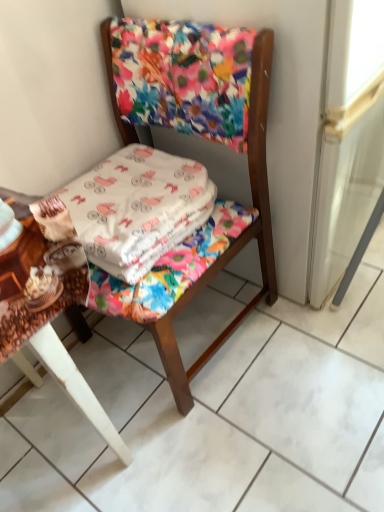
You are a GUI agent. You are given a task and a screenshot of the screen. Output one action in this format:
    pyautogui.click(x=<x>, y=<y>)
    Task: Click on the spots to the right of floral fabric chair at center
    Image resolution: width=384 pixels, height=512 pixels.
    Given the screenshot: What is the action you would take?
    pyautogui.click(x=314, y=348)